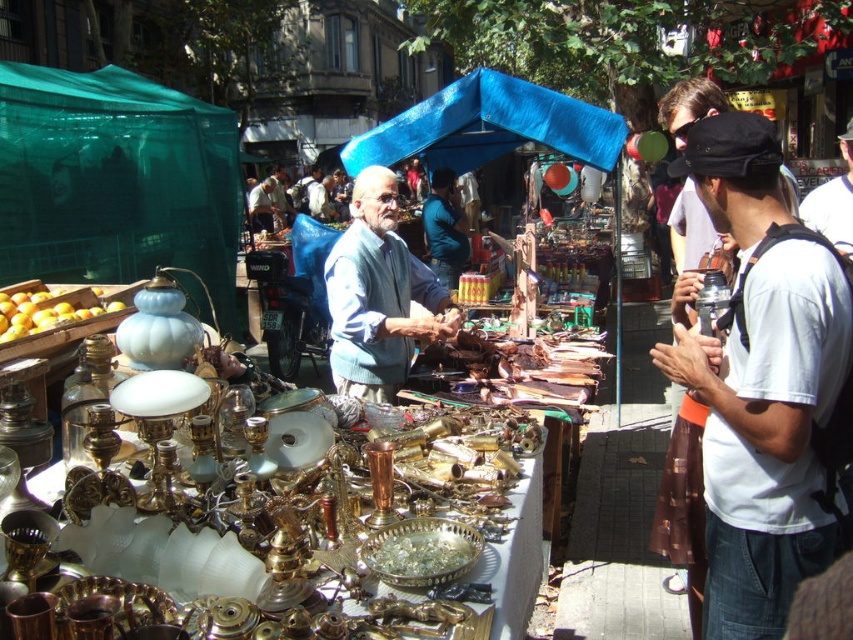
Question: Which point appears farthest from the camera in this image?

Choices:
 (A) (714, 490)
 (B) (438, 234)
 (C) (374, 193)
 (D) (416, 134)

Answer: (B)

Question: Which point is farther to the camera?

Choices:
 (A) pos(374,250)
 (B) pos(527,92)

Answer: (B)

Question: Does black fabric cap at upper right lie behind blue cotton shirt at center?

Choices:
 (A) yes
 (B) no

Answer: (B)

Question: Among these objects, which one is nearest to the camera?

Choices:
 (A) blue fabric canopy at center
 (B) blue cotton shirt at center
 (C) black fabric cap at upper right

Answer: (C)

Question: Can you confirm if black fabric cap at upper right is thinner than blue fabric canopy at center?

Choices:
 (A) yes
 (B) no

Answer: (A)

Question: Is blue fabric canopy at center smaller than blue fabric jacket at center?

Choices:
 (A) yes
 (B) no

Answer: (B)